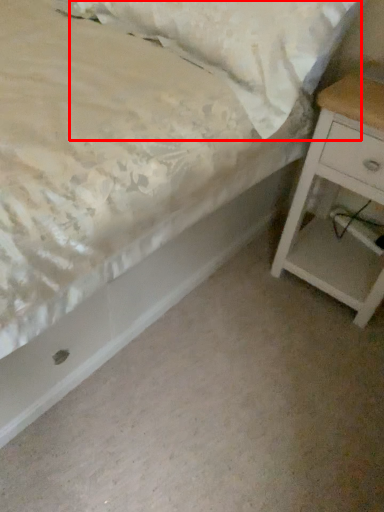
Question: From the image's perspective, where is pillow (annotated by the red box) located in relation to nightstand in the image?

Choices:
 (A) above
 (B) below

Answer: (A)